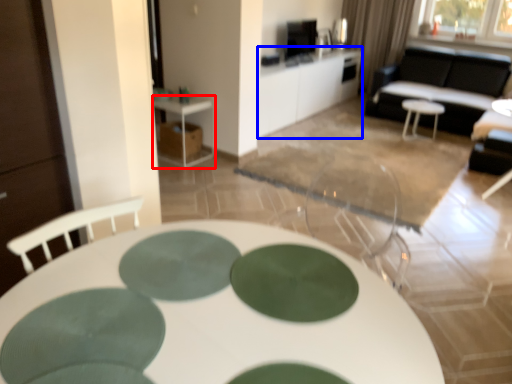
Question: Which point is closer to the camera, table (highlighted by a red box) or table (highlighted by a blue box)?

Choices:
 (A) table
 (B) table

Answer: (A)